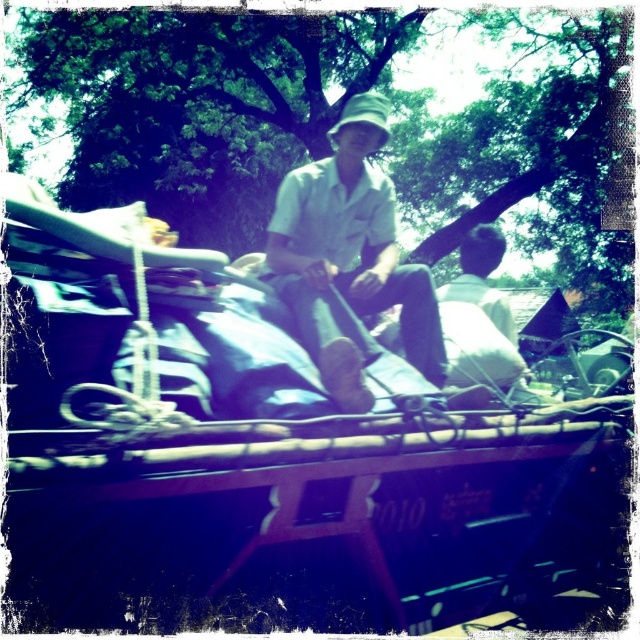
You are standing on the dock and see the wooden boat at center and the white matte shirt at center. Which object is located to the right of the other?

The wooden boat at center is positioned on the right side of white matte shirt at center.

You are planning to place a new item on the wooden boat at center. Considering the size of the white matte shirt at center already present, can you determine if there is enough space for the new item?

The wooden boat at center is larger in size than the white matte shirt at center, so there is likely enough space for the new item as the boat is bigger.